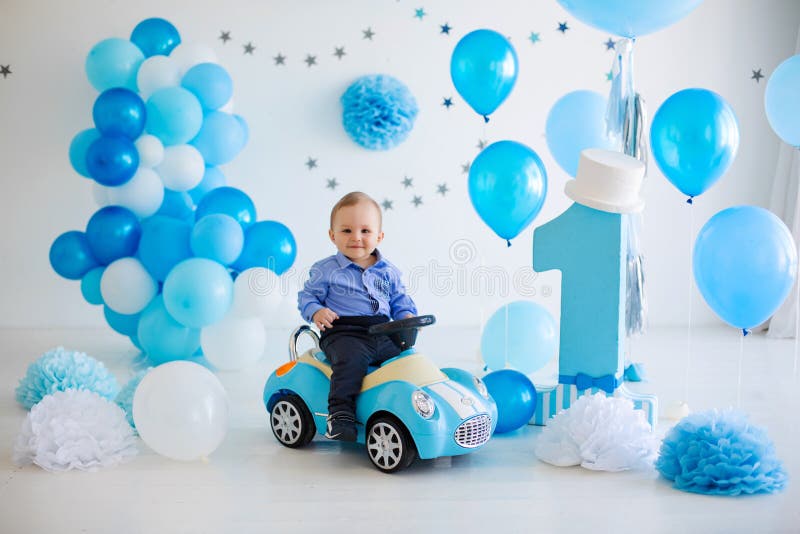
What are the coordinates of `wall` in the screenshot? It's located at (56, 61), (716, 33), (438, 251).